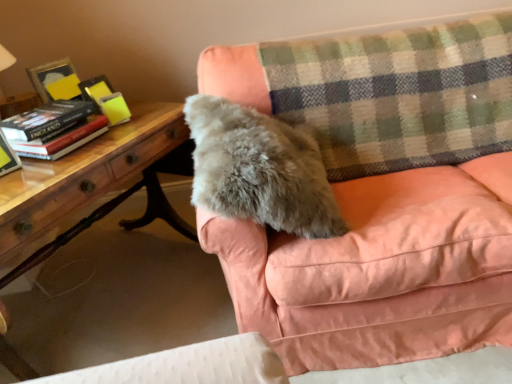
You are a GUI agent. You are given a task and a screenshot of the screen. Output one action in this format:
    pyautogui.click(x=<x>, y=<y>)
    Task: Click on the free space in front of hardcover book at left
    Image resolution: width=512 pixels, height=384 pixels.
    Given the screenshot: What is the action you would take?
    pyautogui.click(x=54, y=172)